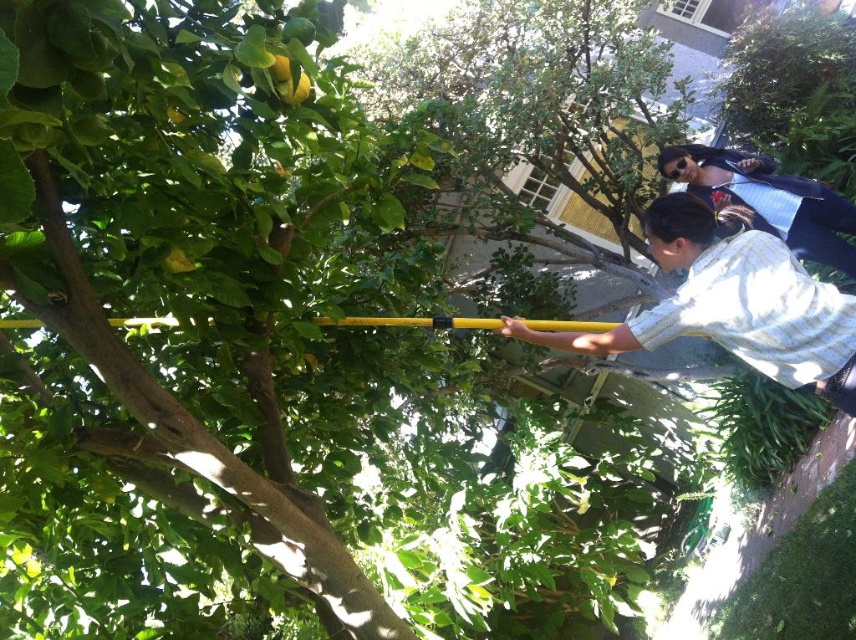
Is yellow matte pole at upper right in front of denim jacket at upper right?

Yes.

Is point (696, 326) positioned behind point (811, 240)?

That is False.

Is point (712, 289) less distant than point (730, 157)?

Yes, it is.

Find the location of a particular element. yellow matte pole at upper right is located at coordinates pos(733,301).

Consider the image. Is denim jacket at upper right closer to the viewer compared to yellow matte pole at center?

No, it is not.

Is denim jacket at upper right thinner than yellow matte pole at center?

Correct, denim jacket at upper right's width is less than yellow matte pole at center's.

You are a GUI agent. You are given a task and a screenshot of the screen. Output one action in this format:
    pyautogui.click(x=<x>, y=<y>)
    Task: Click on the denim jacket at upper right
    The width and height of the screenshot is (856, 640).
    Given the screenshot: What is the action you would take?
    pyautogui.click(x=768, y=198)

Locate an element on the screen. The image size is (856, 640). denim jacket at upper right is located at coordinates (768, 198).

Is yellow matte pole at upper right to the left of yellow matte pole at center from the viewer's perspective?

Incorrect, yellow matte pole at upper right is not on the left side of yellow matte pole at center.

Which of these two, yellow matte pole at upper right or yellow matte pole at center, stands taller?

yellow matte pole at upper right

Is point (556, 340) farther from viewer compared to point (366, 320)?

Yes, it is.

At what (x,y) coordinates should I click in order to perform the action: click on yellow matte pole at upper right. Please return your answer as a coordinate pair (x, y). The image size is (856, 640). Looking at the image, I should click on (733, 301).